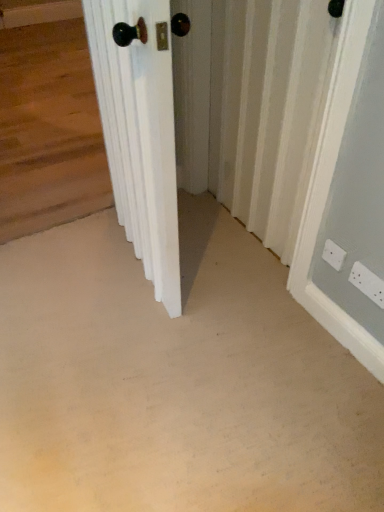
Question: Does point (365, 266) appear closer or farther from the camera than point (155, 201)?

Choices:
 (A) closer
 (B) farther

Answer: (A)

Question: From the image's perspective, is white plastic electric outlet at lower right, the 1th electric outlet when ordered from right to left, positioned above or below white wooden door at center?

Choices:
 (A) above
 (B) below

Answer: (B)

Question: Based on their relative distances, which object is nearer to the white textured radiator at center?

Choices:
 (A) white plastic electric outlet at lower right, acting as the 2th electric outlet starting from the left
 (B) white plastic electric outlet at lower right, which is the first electric outlet in left-to-right order
 (C) beige carpet at center
 (D) white wooden door at center

Answer: (D)

Question: Which of these objects is positioned farthest from the white wooden door at center?

Choices:
 (A) white plastic electric outlet at lower right, the 1th electric outlet when ordered from right to left
 (B) white textured radiator at center
 (C) white plastic electric outlet at lower right, the second electric outlet from the right
 (D) beige carpet at center

Answer: (A)